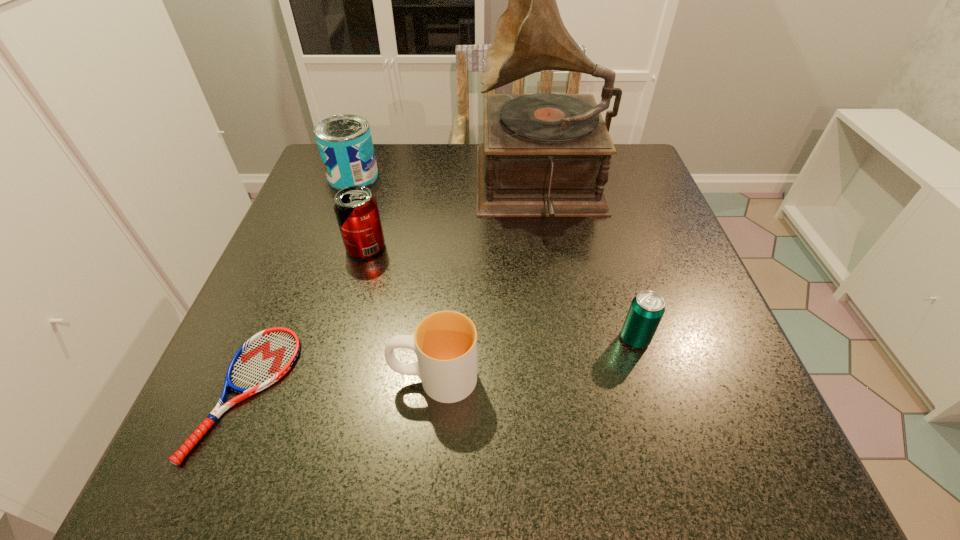
Where is `free spot located 0.080m on the left of the soda can`? The width and height of the screenshot is (960, 540). free spot located 0.080m on the left of the soda can is located at coordinates (306, 247).

Find the location of `vacant space located with the handle on the side of the cup`. vacant space located with the handle on the side of the cup is located at coordinates (223, 378).

The height and width of the screenshot is (540, 960). What are the coordinates of `vacant space located with the handle on the side of the cup` in the screenshot? It's located at (281, 378).

Locate an element on the screen. The image size is (960, 540). free space located with the handle on the side of the cup is located at coordinates (223, 378).

At what (x,y) coordinates should I click in order to perform the action: click on free space located 0.110m on the front of the beer can. Please return your answer as a coordinate pair (x, y). This screenshot has width=960, height=540. Looking at the image, I should click on (658, 415).

Where is `free space located 0.400m on the right of the tennis racket`? The width and height of the screenshot is (960, 540). free space located 0.400m on the right of the tennis racket is located at coordinates (554, 392).

Image resolution: width=960 pixels, height=540 pixels. I want to click on record player that is at the far edge, so click(x=544, y=154).

Where is `can that is at the far edge`? This screenshot has width=960, height=540. can that is at the far edge is located at coordinates (345, 144).

Locate an element on the screen. The image size is (960, 540). object situated at the near edge is located at coordinates (266, 357).

I want to click on can at the left edge, so click(345, 144).